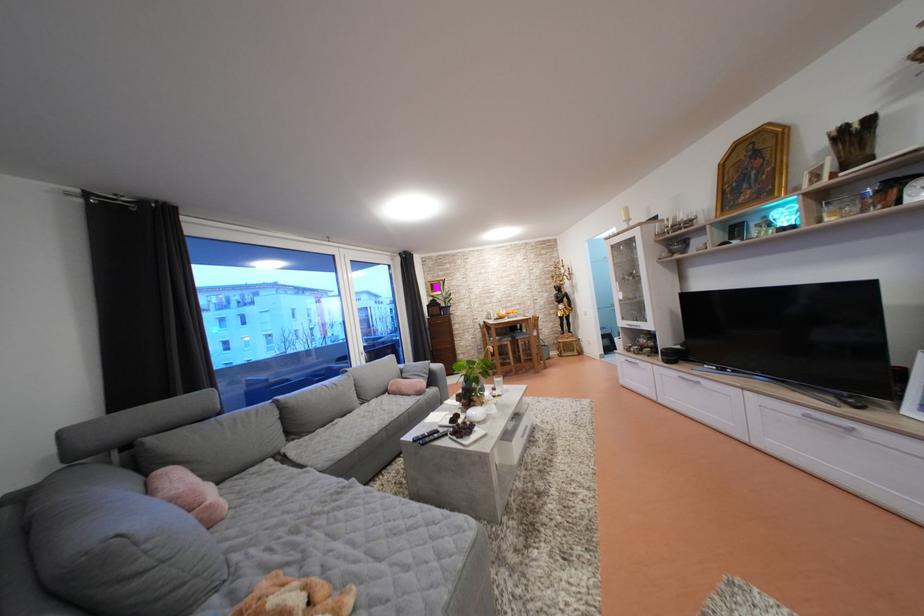
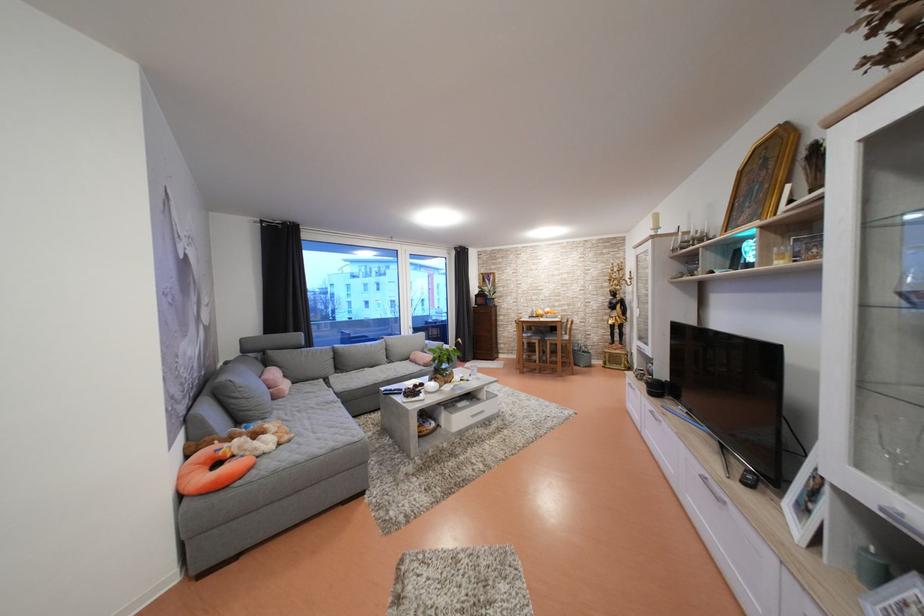
In the second image, find the point that corresponds to [636,225] in the first image.

(664, 233)